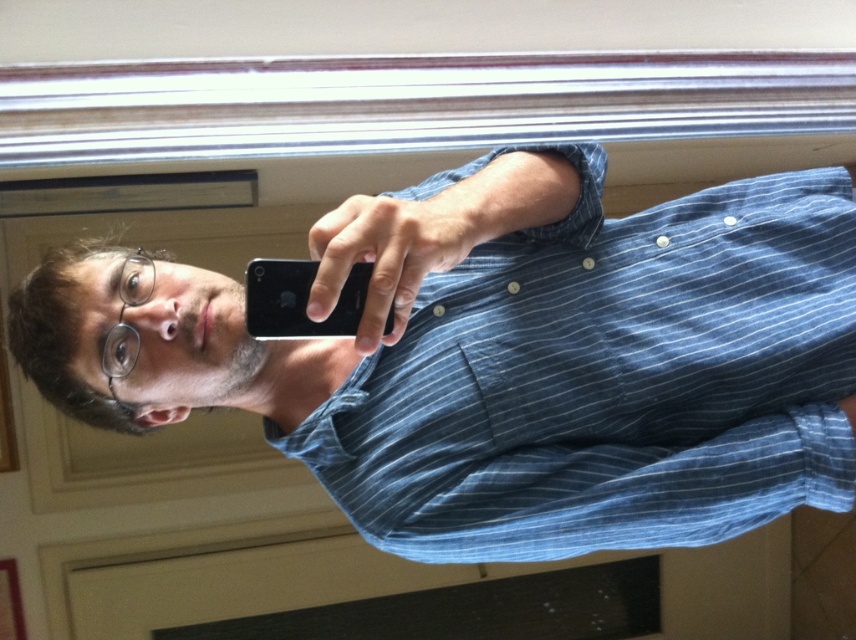
You are trying to take a better selfie and want to adjust the position of the black matte smartphone at center so that it aligns with the blue striped shirt at center. Based on the current arrangement, which direction should you move the smartphone to achieve this alignment?

The blue striped shirt at center is to the right of the black matte smartphone at center, so you should move the smartphone to the right to align it with the blue striped shirt at center.

You are a photographer trying to capture a clear selfie. You notice the blue striped shirt at center and the black matte smartphone at center. Which object is closer to you, the photographer?

A: The blue striped shirt at center is closer to you because it is positioned further to the viewer than the black matte smartphone at center.

You are trying to take a selfie with your phone and want to ensure your entire blue striped shirt at center is visible in the frame. Given the black matte smartphone at center you are holding, will the shirt fit within the camera view?

The blue striped shirt at center is wider than the black matte smartphone at center, so the shirt may not fit entirely within the camera view unless you move the phone further away or adjust your position to capture more of the shirt.